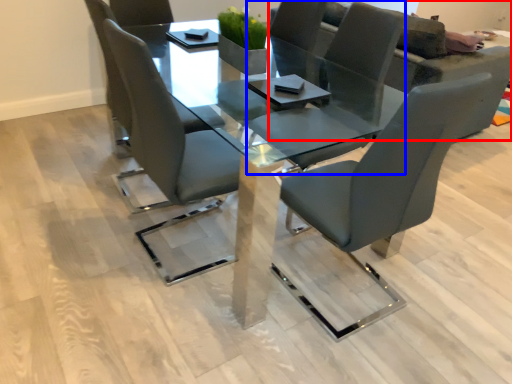
Question: Which object appears farthest to the camera in this image, couch (highlighted by a red box) or chair (highlighted by a blue box)?

Choices:
 (A) couch
 (B) chair

Answer: (A)